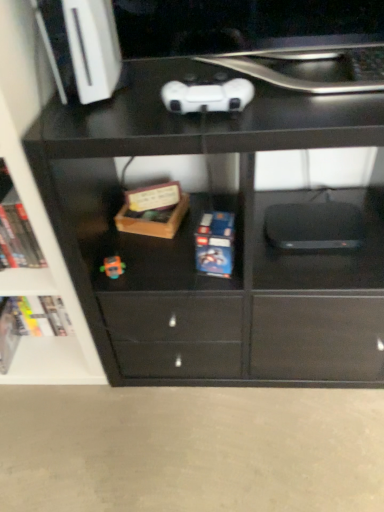
This screenshot has height=512, width=384. Identify the location of hardcover book at lower left, the second book when ordered from front to back. (42, 315).

Describe the element at coordinates (367, 63) in the screenshot. I see `black matte laptop keyboard at upper center` at that location.

At what (x,y) coordinates should I click in order to perform the action: click on black matte chest of drawers at center. Please return your answer as a coordinate pair (x, y). Image resolution: width=384 pixels, height=512 pixels. Looking at the image, I should click on (234, 240).

What are the coordinates of `hardcover book at left, placed as the second book when sorted from back to front` in the screenshot? It's located at (18, 234).

Is wooden box at center to the left of hardcover book at left, the first paperback book from the left, from the viewer's perspective?

No, wooden box at center is not to the left of hardcover book at left, the first paperback book from the left.

Could you measure the distance between wooden box at center and hardcover book at left, which is the first paperback book from back to front?

wooden box at center and hardcover book at left, which is the first paperback book from back to front, are 19.58 inches apart from each other.

Considering the sizes of wooden box at center and hardcover book at left, which ranks as the second paperback book in front-to-back order, in the image, is wooden box at center bigger or smaller than hardcover book at left, which ranks as the second paperback book in front-to-back order,?

wooden box at center is smaller than hardcover book at left, which ranks as the second paperback book in front-to-back order.

From the picture: Does wooden box at center turn towards hardcover book at left, marked as the 1th paperback book in a bottom-to-top arrangement?

No, wooden box at center is not turned towards hardcover book at left, marked as the 1th paperback book in a bottom-to-top arrangement.

Looking at this image, is black matte laptop keyboard at upper center taller than hardcover book at lower left, which is the first book from back to front?

No, black matte laptop keyboard at upper center is not taller than hardcover book at lower left, which is the first book from back to front.

The width and height of the screenshot is (384, 512). I want to click on laptop keyboard above the hardcover book at lower left, which is the first book from back to front (from a real-world perspective), so click(367, 63).

Which object is closer to the camera, black matte laptop keyboard at upper center or hardcover book at lower left, positioned as the 1th book in bottom-to-top order?

black matte laptop keyboard at upper center is more forward.

Between black matte laptop keyboard at upper center and hardcover book at lower left, which is the first book from back to front, which one has smaller width?

hardcover book at lower left, which is the first book from back to front, is thinner.

Considering the sizes of white matte game controller at upper center and black matte chest of drawers at center in the image, is white matte game controller at upper center taller or shorter than black matte chest of drawers at center?

In the image, white matte game controller at upper center appears to be shorter than black matte chest of drawers at center.

Is the depth of white matte game controller at upper center less than that of black matte chest of drawers at center?

No, white matte game controller at upper center is further to the viewer.

Looking at this image, can you confirm if white matte game controller at upper center is wider than black matte chest of drawers at center?

No, white matte game controller at upper center is not wider than black matte chest of drawers at center.

Who is smaller, wooden box at center or black matte shelf at upper left?

Smaller between the two is wooden box at center.

Is wooden box at center next to black matte shelf at upper left?

There is a gap between wooden box at center and black matte shelf at upper left.

Considering the relative sizes of wooden box at center and black matte shelf at upper left in the image provided, is wooden box at center taller than black matte shelf at upper left?

Incorrect, the height of wooden box at center is not larger of that of black matte shelf at upper left.

Is wooden box at center oriented towards black matte shelf at upper left?

No.

Is the position of hardcover book at left, the first paperback book from the left, less distant than that of blue matte lego box at center, the second paperback book positioned from the bottom?

That is False.

Would you say hardcover book at left, which ranks as the second paperback book in right-to-left order, is a long distance from blue matte lego box at center, positioned as the 1th paperback book in front-to-back order?

No, there isn't a large distance between hardcover book at left, which ranks as the second paperback book in right-to-left order, and blue matte lego box at center, positioned as the 1th paperback book in front-to-back order.

From the image's perspective, does hardcover book at left, the first paperback book from the left, appear higher than blue matte lego box at center, the second paperback book positioned from the bottom?

No, from the image's perspective, hardcover book at left, the first paperback book from the left, is not on top of blue matte lego box at center, the second paperback book positioned from the bottom.

Considering the points (11, 353) and (225, 264), which point is behind, point (11, 353) or point (225, 264)?

The point (11, 353) is farther from the camera.

How different are the orientations of hardcover book at left, which is the second book from bottom to top, and black matte chest of drawers at center in degrees?

The facing directions of hardcover book at left, which is the second book from bottom to top, and black matte chest of drawers at center are 1.29 degrees apart.

Is hardcover book at left, which is the 1th book from top to bottom, wider than black matte chest of drawers at center?

No, hardcover book at left, which is the 1th book from top to bottom, is not wider than black matte chest of drawers at center.

In the scene shown: Considering their positions, is hardcover book at left, which is the second book from bottom to top, located in front of or behind black matte chest of drawers at center?

Clearly, hardcover book at left, which is the second book from bottom to top, is behind black matte chest of drawers at center.

Could you measure the distance between hardcover book at left, which is the second book from bottom to top, and black matte chest of drawers at center?

A distance of 17.70 inches exists between hardcover book at left, which is the second book from bottom to top, and black matte chest of drawers at center.

Does black matte chest of drawers at center have a greater height compared to black matte shelf at upper left?

No.

Consider the image. From a real-world perspective, who is located lower, black matte chest of drawers at center or black matte shelf at upper left?

black matte chest of drawers at center is physically lower.

How different are the orientations of black matte chest of drawers at center and black matte shelf at upper left in degrees?

There is a 2.01-degree angle between the facing directions of black matte chest of drawers at center and black matte shelf at upper left.

Where is `box on the right of hardcover book at left, which ranks as the second paperback book in right-to-left order`? box on the right of hardcover book at left, which ranks as the second paperback book in right-to-left order is located at coordinates (153, 211).

From a real-world perspective, count 2nd books downward from the black matte laptop keyboard at upper center and point to it. Please provide its 2D coordinates.

[(42, 315)]

When comparing their distances from black matte shelf at upper left, does hardcover book at lower left, the second book from the top, or hardcover book at left, placed as the second book when sorted from back to front, seem closer?

The object closer to black matte shelf at upper left is hardcover book at lower left, the second book from the top.

Looking at the image, which one is located closer to white matte game controller at upper center, black matte shelf at upper left or blue matte lego box at center, which is the 2th paperback book from back to front?

Based on the image, blue matte lego box at center, which is the 2th paperback book from back to front, appears to be nearer to white matte game controller at upper center.

Based on their spatial positions, is hardcover book at left, which is the second book from bottom to top, or wooden box at center further from black matte shelf at upper left?

wooden box at center is further to black matte shelf at upper left.

From the image, which object appears to be farther from white matte game controller at upper center, hardcover book at lower left, which is the first book from back to front, or black matte shelf at upper left?

hardcover book at lower left, which is the first book from back to front, is further to white matte game controller at upper center.

Looking at the image, which one is located closer to black matte chest of drawers at center, hardcover book at lower left, the second book from the top, or wooden box at center?

The object closer to black matte chest of drawers at center is wooden box at center.

Estimate the real-world distances between objects in this image. Which object is further from translucent plastic toy at center, black matte chest of drawers at center or white matte game controller at upper center?

The object further to translucent plastic toy at center is white matte game controller at upper center.

From the image, which object appears to be farther from hardcover book at left, the 2th paperback book viewed from the top, white matte game controller at upper center or hardcover book at lower left, positioned as the 1th book in bottom-to-top order?

white matte game controller at upper center.

Looking at the image, which one is located closer to white matte game controller at upper center, hardcover book at lower left, the second book when ordered from front to back, or black matte laptop keyboard at upper center?

black matte laptop keyboard at upper center is closer to white matte game controller at upper center.

Image resolution: width=384 pixels, height=512 pixels. Find the location of `game controller situated between black matte shelf at upper left and black matte chest of drawers at center from left to right`. game controller situated between black matte shelf at upper left and black matte chest of drawers at center from left to right is located at coordinates (207, 96).

Identify the location of the chest of drawers located between hardcover book at left, marked as the 1th paperback book in a bottom-to-top arrangement, and black matte laptop keyboard at upper center in the left-right direction. (234, 240).

Where is `game controller between wooden box at center and black matte laptop keyboard at upper center`? The image size is (384, 512). game controller between wooden box at center and black matte laptop keyboard at upper center is located at coordinates (207, 96).

Find the location of a particular element. The width and height of the screenshot is (384, 512). toy between hardcover book at lower left, which is the first book from back to front, and black matte chest of drawers at center, in the horizontal direction is located at coordinates (113, 267).